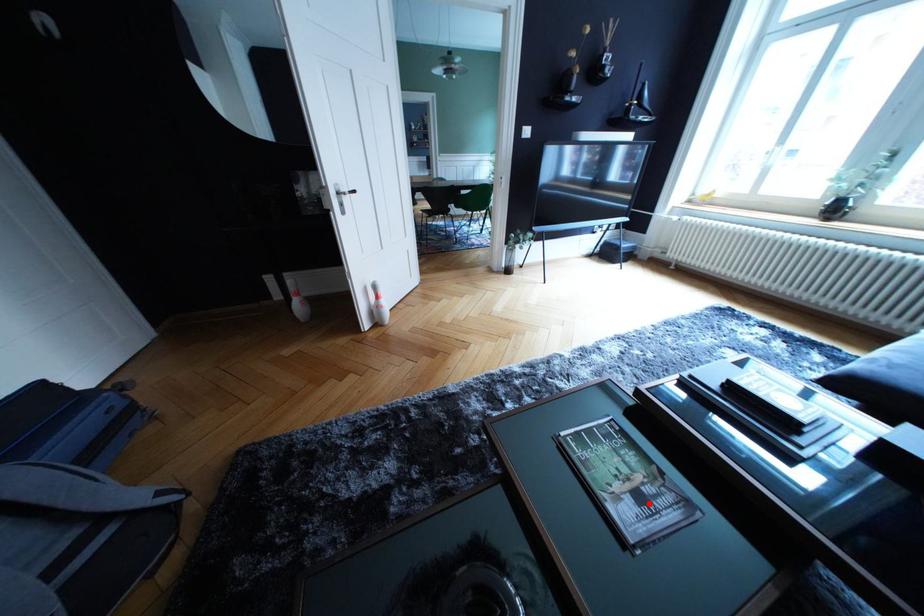
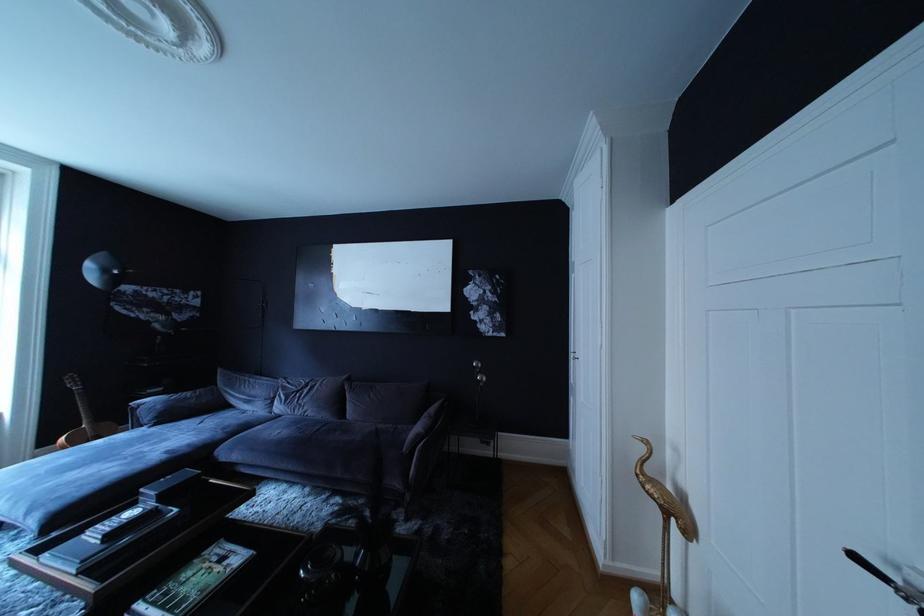
Where in the second image is the point corresponding to the highlighted location from the first image?

(232, 565)